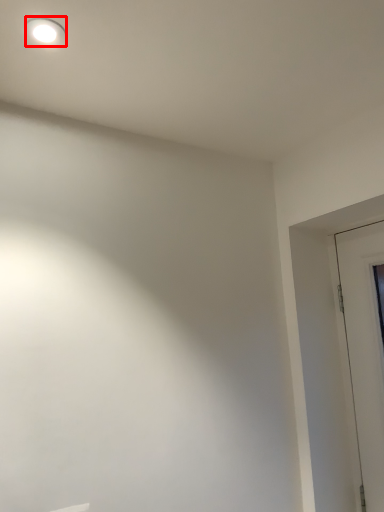
Question: Observing the image, what is the correct spatial positioning of lighting (annotated by the red box) in reference to door?

Choices:
 (A) left
 (B) right

Answer: (A)